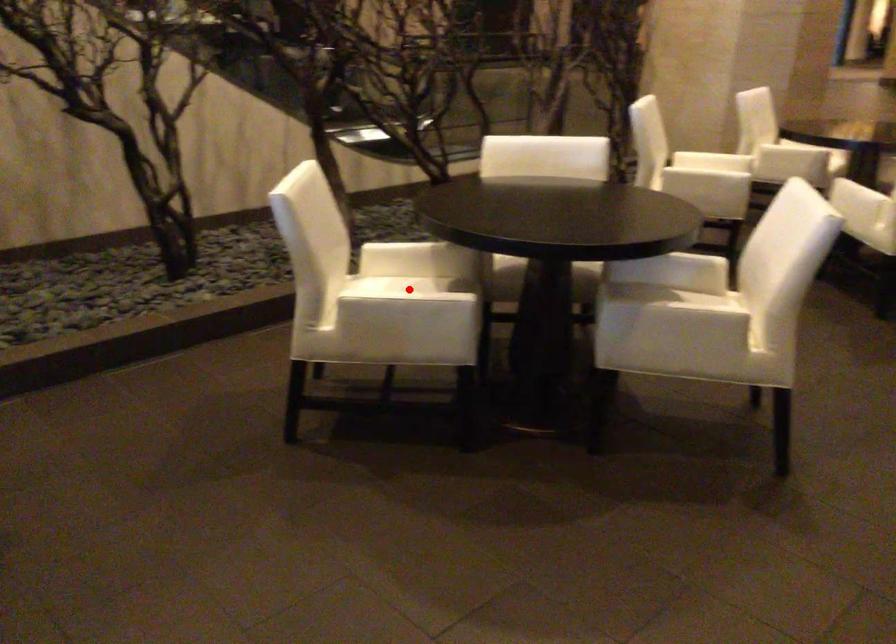
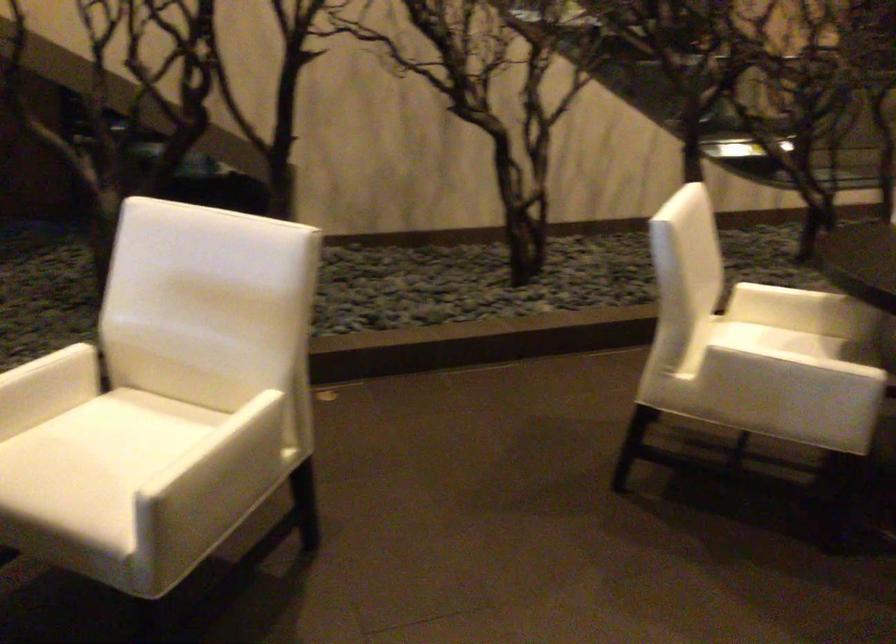
Question: I am providing you with two images of the same scene from different viewpoints. In image1, a red point is highlighted. Considering the same 3D point in image2, which of the following is correct?

Choices:
 (A) It is closer
 (B) It is farther

Answer: (A)